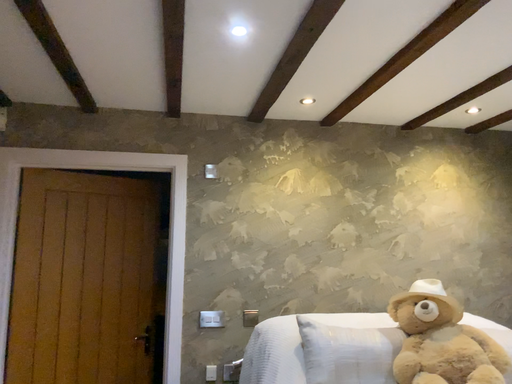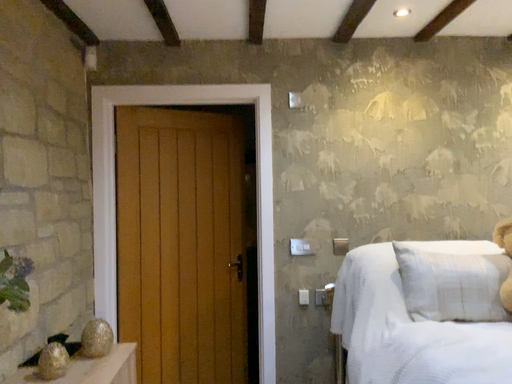
Question: Which way did the camera rotate in the video?

Choices:
 (A) rotated upward
 (B) rotated downward

Answer: (B)